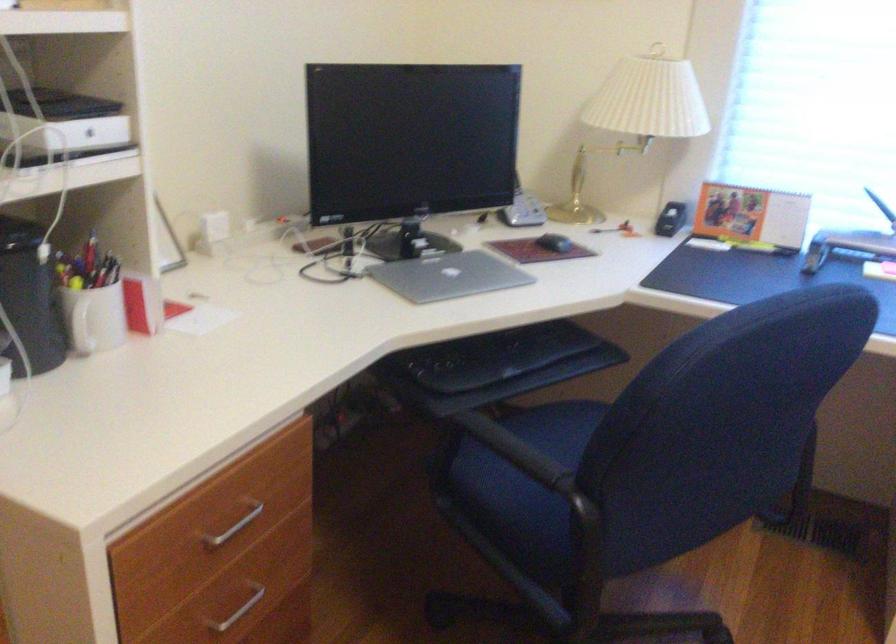
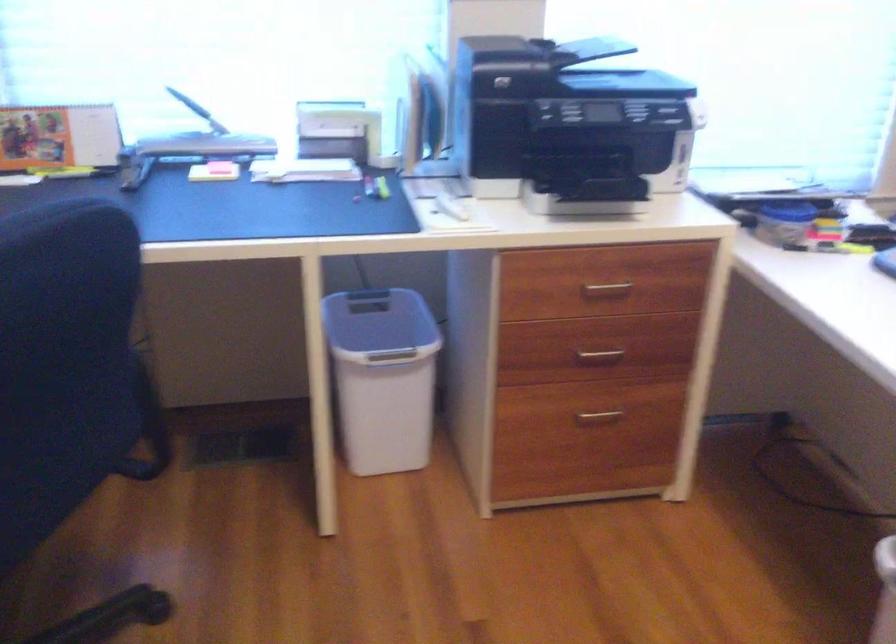
Question: How did the camera likely rotate?

Choices:
 (A) Left
 (B) Right
 (C) Up
 (D) Down

Answer: (B)